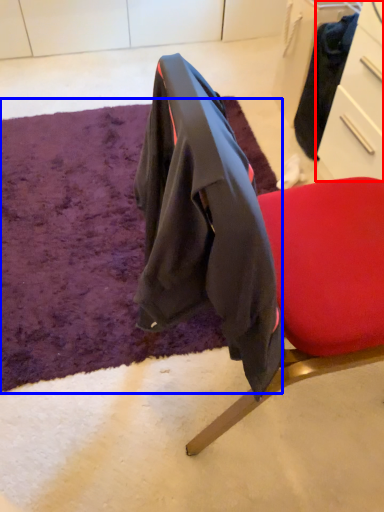
Question: Which object is closer to the camera taking this photo, drawer (highlighted by a red box) or mat (highlighted by a blue box)?

Choices:
 (A) drawer
 (B) mat

Answer: (B)